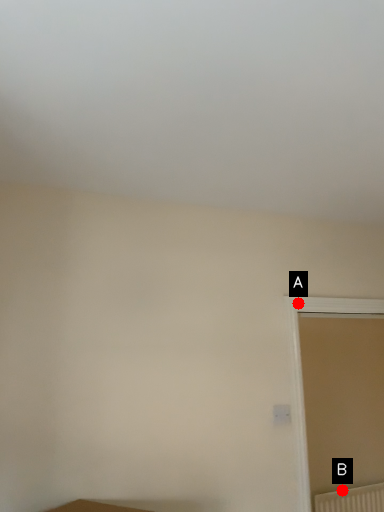
Question: Two points are circled on the image, labeled by A and B beside each circle. Which point is further to the camera?

Choices:
 (A) A is further
 (B) B is further

Answer: (B)